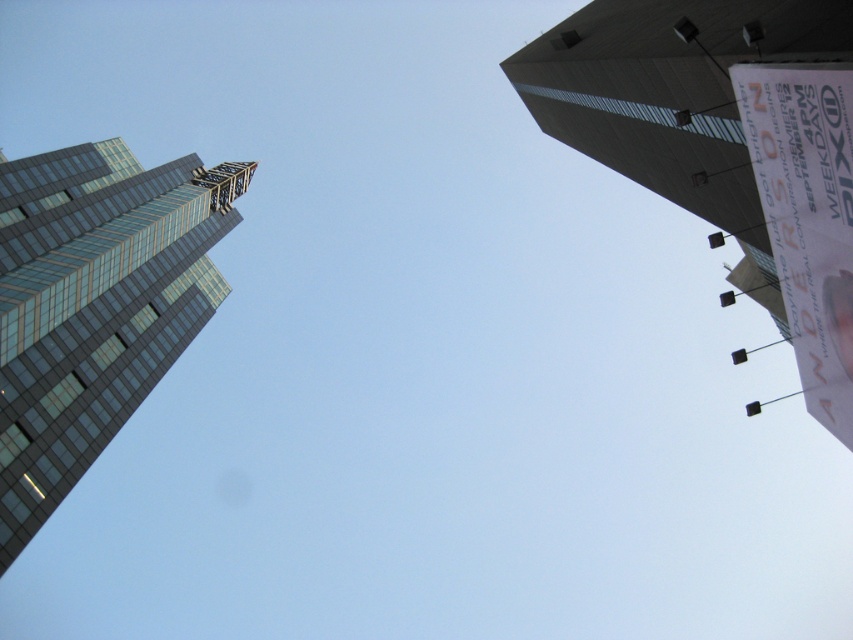
Question: Among these objects, which one is farthest from the camera?

Choices:
 (A) glassy steel skyscraper at left
 (B) smooth concrete tower at upper right

Answer: (A)

Question: Which of the following is the closest to the observer?

Choices:
 (A) (619, 99)
 (B) (122, 390)

Answer: (A)

Question: Does smooth concrete tower at upper right have a larger size compared to glassy steel skyscraper at left?

Choices:
 (A) no
 (B) yes

Answer: (A)

Question: Which of the following is the closest to the observer?

Choices:
 (A) smooth concrete tower at upper right
 (B) glassy steel skyscraper at left

Answer: (A)

Question: Is the position of smooth concrete tower at upper right less distant than that of glassy steel skyscraper at left?

Choices:
 (A) no
 (B) yes

Answer: (B)

Question: Can you confirm if smooth concrete tower at upper right is bigger than glassy steel skyscraper at left?

Choices:
 (A) yes
 (B) no

Answer: (B)